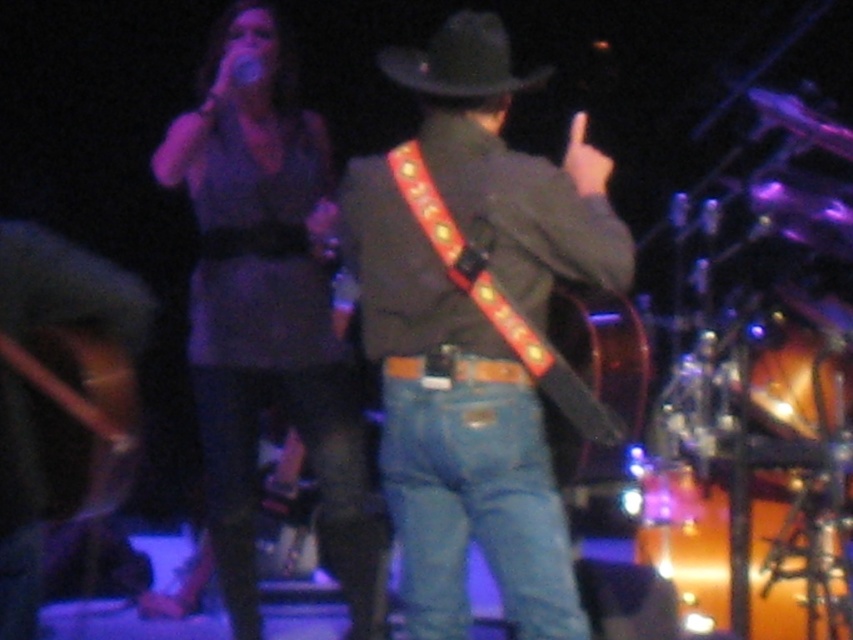
What is the color of the dress at the point specified by the coordinates point (x=270, y=316)?

The point (x=270, y=316) is on a matte purple dress at upper left, so the color is purple.

You are a photographer positioned at the back of the venue. You want to capture a photo where both the blue denim jeans at center and the black felt hat at upper center are in focus. Given that your camera can only focus on objects within a 30 inch range, will you be able to achieve this?

The blue denim jeans at center is 38.78 inches away from the black felt hat at upper center. Since the distance exceeds the camera focus range of 30 inches, the photographer cannot have both in focus.